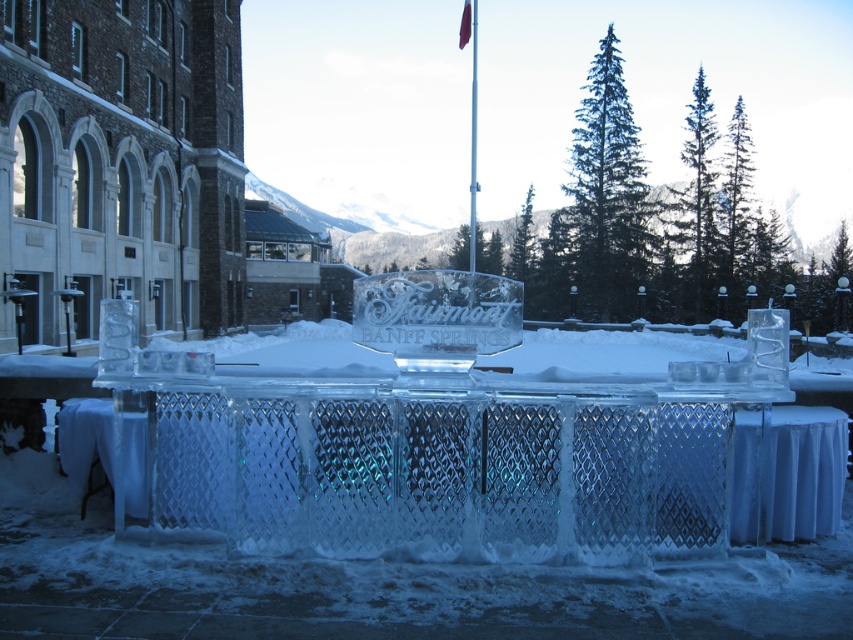
Who is more distant from viewer, (614, 44) or (471, 236)?

The point (614, 44) is behind.

Is green needle-like tree at upper center further to camera compared to metallic flag pole at center?

Yes, green needle-like tree at upper center is behind metallic flag pole at center.

Between point (573, 205) and point (471, 177), which one is positioned in front?

Point (471, 177)

This screenshot has width=853, height=640. What are the coordinates of `green needle-like tree at upper center` in the screenshot? It's located at (607, 192).

How much distance is there between clear ice table at center and metallic flag pole at center?

clear ice table at center and metallic flag pole at center are 39.21 meters apart from each other.

In the scene shown: Can you confirm if clear ice table at center is positioned to the left of metallic flag pole at center?

Correct, you'll find clear ice table at center to the left of metallic flag pole at center.

Identify the location of clear ice table at center. The width and height of the screenshot is (853, 640). (805, 472).

Image resolution: width=853 pixels, height=640 pixels. I want to click on clear ice table at center, so click(805, 472).

Describe the element at coordinates (607, 192) in the screenshot. I see `green needle-like tree at upper center` at that location.

At what (x,y) coordinates should I click in order to perform the action: click on green needle-like tree at upper center. Please return your answer as a coordinate pair (x, y). Looking at the image, I should click on [x=607, y=192].

Where is `green needle-like tree at upper center`? green needle-like tree at upper center is located at coordinates (607, 192).